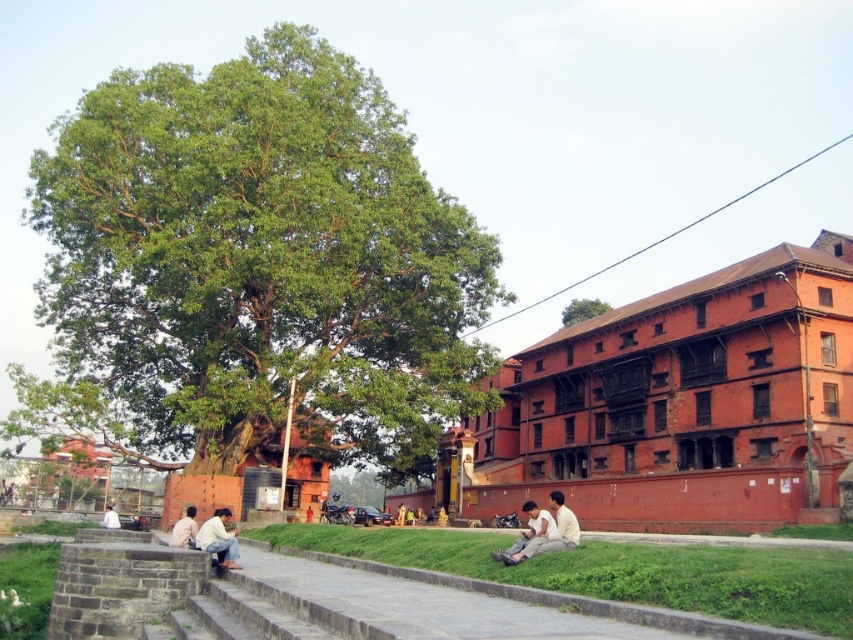
Question: Which object is closer to the camera taking this photo?

Choices:
 (A) green grass at lower left
 (B) white cotton shirt at center
 (C) green leafy tree at upper center
 (D) light blue jeans at lower center

Answer: (A)

Question: Considering the relative positions of white fabric shirt at lower center and white cotton shirt at center in the image provided, where is white fabric shirt at lower center located with respect to white cotton shirt at center?

Choices:
 (A) above
 (B) below

Answer: (A)

Question: Can you confirm if light brown wooden bench at lower center is thinner than green leafy tree at upper center?

Choices:
 (A) no
 (B) yes

Answer: (B)

Question: Which object is the closest to the light brown wooden bench at lower center?

Choices:
 (A) white fabric shirt at lower center
 (B) green grass at lower left
 (C) green leafy tree at center

Answer: (A)

Question: Which point is closer to the camera?

Choices:
 (A) green grass at lower left
 (B) light blue jeans at lower center
 (C) green grass at lower center
 (D) green leafy tree at upper center

Answer: (C)

Question: Can you confirm if light brown wooden bench at lower center is positioned to the right of white fabric shirt at lower center?

Choices:
 (A) yes
 (B) no

Answer: (A)